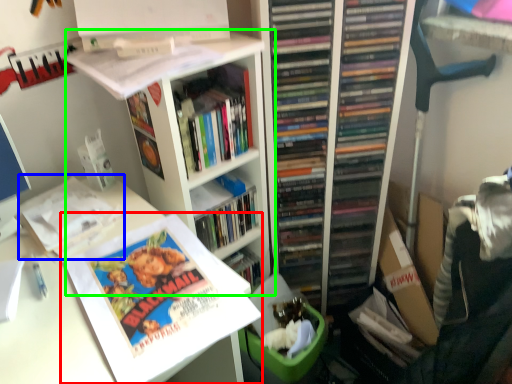
Question: Considering the real-world distances, which object is farthest from book (highlighted by a red box)? book (highlighted by a blue box) or bookshelf (highlighted by a green box)?

Choices:
 (A) book
 (B) bookshelf

Answer: (B)